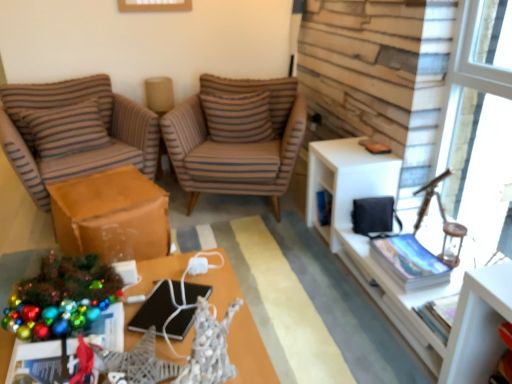
Question: Is brown striped fabric chair at left, acting as the first chair starting from the left, facing towards metallic silver desk at center?

Choices:
 (A) no
 (B) yes

Answer: (B)

Question: Can you confirm if brown striped fabric chair at left, positioned as the second chair in right-to-left order, is positioned to the right of metallic silver desk at center?

Choices:
 (A) yes
 (B) no

Answer: (B)

Question: Does brown striped fabric chair at left, positioned as the second chair in right-to-left order, have a larger size compared to metallic silver desk at center?

Choices:
 (A) yes
 (B) no

Answer: (A)

Question: Is brown striped fabric chair at left, positioned as the second chair in right-to-left order, not near metallic silver desk at center?

Choices:
 (A) yes
 (B) no

Answer: (A)

Question: From the image's perspective, would you say brown striped fabric chair at left, positioned as the second chair in right-to-left order, is shown under metallic silver desk at center?

Choices:
 (A) no
 (B) yes

Answer: (A)

Question: Is metallic silver desk at center in front of or behind striped fabric pillow at left, the second pillow when ordered from right to left, in the image?

Choices:
 (A) front
 (B) behind

Answer: (A)

Question: Considering the positions of point [220, 309] and point [81, 119], is point [220, 309] closer or farther from the camera than point [81, 119]?

Choices:
 (A) farther
 (B) closer

Answer: (B)

Question: Considering the positions of metallic silver desk at center and striped fabric pillow at left, which ranks as the first pillow in left-to-right order, in the image, is metallic silver desk at center bigger or smaller than striped fabric pillow at left, which ranks as the first pillow in left-to-right order,?

Choices:
 (A) big
 (B) small

Answer: (A)

Question: From the image's perspective, is metallic silver desk at center located above or below striped fabric pillow at left, which ranks as the first pillow in left-to-right order?

Choices:
 (A) below
 (B) above

Answer: (A)

Question: Relative to brown striped fabric chair at left, positioned as the second chair in right-to-left order, is metallic silver desk at center in front or behind?

Choices:
 (A) front
 (B) behind

Answer: (A)

Question: From the image's perspective, is metallic silver desk at center above or below brown striped fabric chair at left, acting as the first chair starting from the left?

Choices:
 (A) below
 (B) above

Answer: (A)

Question: Looking at the image, does metallic silver desk at center seem bigger or smaller compared to brown striped fabric chair at left, acting as the first chair starting from the left?

Choices:
 (A) small
 (B) big

Answer: (A)

Question: Considering the positions of point (271, 367) and point (0, 87), is point (271, 367) closer or farther from the camera than point (0, 87)?

Choices:
 (A) closer
 (B) farther

Answer: (A)

Question: From the image's perspective, is metallic silver desk at center above or below brown striped pillow at center, the first pillow in the right-to-left sequence?

Choices:
 (A) above
 (B) below

Answer: (B)

Question: Is metallic silver desk at center bigger or smaller than brown striped pillow at center, which is the second pillow in left-to-right order?

Choices:
 (A) small
 (B) big

Answer: (B)